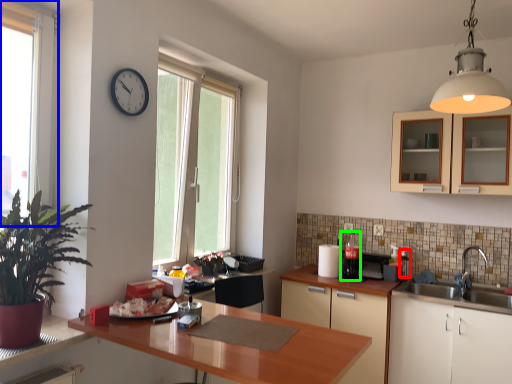
Question: Based on their relative distances, which object is farther from appliance (highlighted by a red box)? Choose from window (highlighted by a blue box) and appliance (highlighted by a green box).

Choices:
 (A) window
 (B) appliance

Answer: (A)